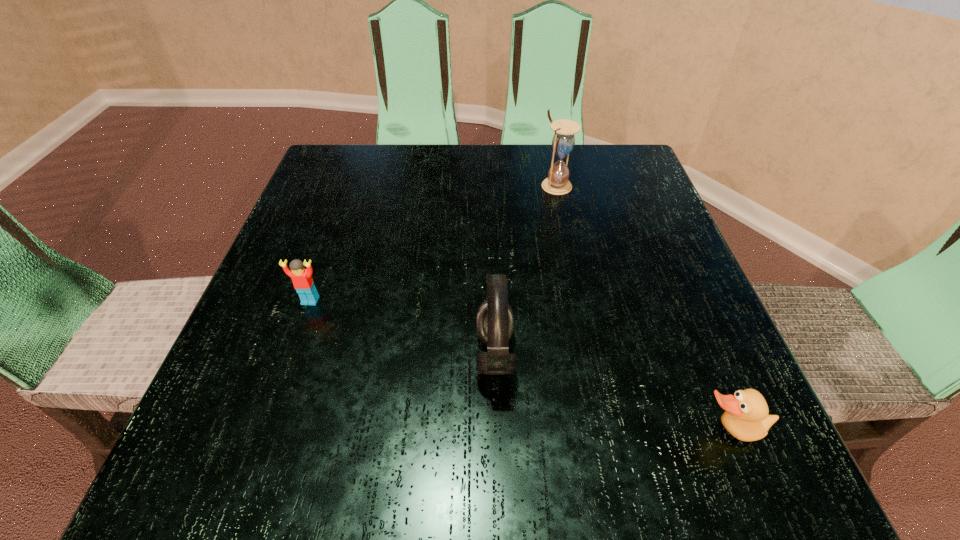
Locate an element on the screen. The width and height of the screenshot is (960, 540). vacant space at the left edge is located at coordinates (331, 217).

Where is `vacant space at the right edge of the desktop`? The image size is (960, 540). vacant space at the right edge of the desktop is located at coordinates (708, 423).

This screenshot has width=960, height=540. Identify the location of vacant space at the far left corner. (357, 154).

Where is `vacant area that lies between the leftmost object and the hourglass`? Image resolution: width=960 pixels, height=540 pixels. vacant area that lies between the leftmost object and the hourglass is located at coordinates (433, 243).

Where is `vacant area between the third nearest object and the headset`? vacant area between the third nearest object and the headset is located at coordinates (402, 328).

What are the coordinates of `blank region between the hourglass and the second nearest object` in the screenshot? It's located at (526, 270).

This screenshot has height=540, width=960. I want to click on free space between the nearest object and the third object from right to left, so click(x=612, y=393).

You are a GUI agent. You are given a task and a screenshot of the screen. Output one action in this format:
    pyautogui.click(x=<x>, y=<y>)
    Task: Click on the vacant space that's between the farthest object and the headset
    This screenshot has width=960, height=540.
    Given the screenshot: What is the action you would take?
    pyautogui.click(x=526, y=270)

Locate an element on the screen. The height and width of the screenshot is (540, 960). free space between the second object from right to left and the third object from right to left is located at coordinates (526, 270).

Find the location of a particular element. vacant point located between the duck and the third farthest object is located at coordinates (612, 393).